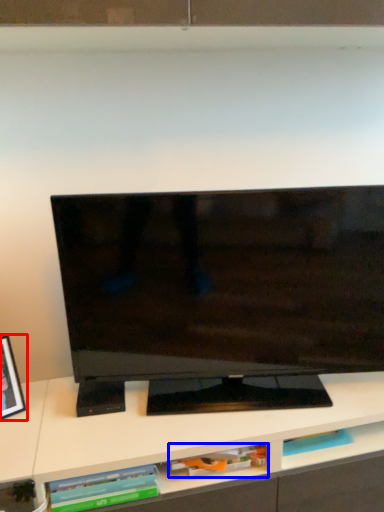
Question: Which point is further to the camera, picture frame (highlighted by a red box) or book (highlighted by a blue box)?

Choices:
 (A) picture frame
 (B) book

Answer: (B)